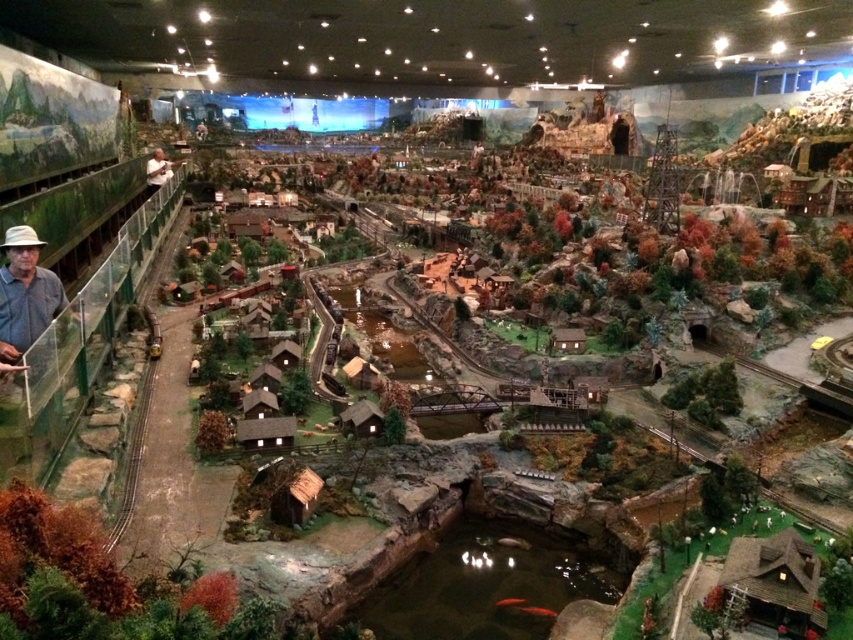
Is denim shirt at left smaller than smooth tan shirt at left?

Yes, denim shirt at left is smaller than smooth tan shirt at left.

Between point (10, 300) and point (160, 179), which one is positioned behind?

Point (160, 179)

Between point (10, 300) and point (148, 173), which one is positioned in front?

Point (10, 300) is in front.

Locate an element on the screen. The image size is (853, 640). denim shirt at left is located at coordinates (25, 292).